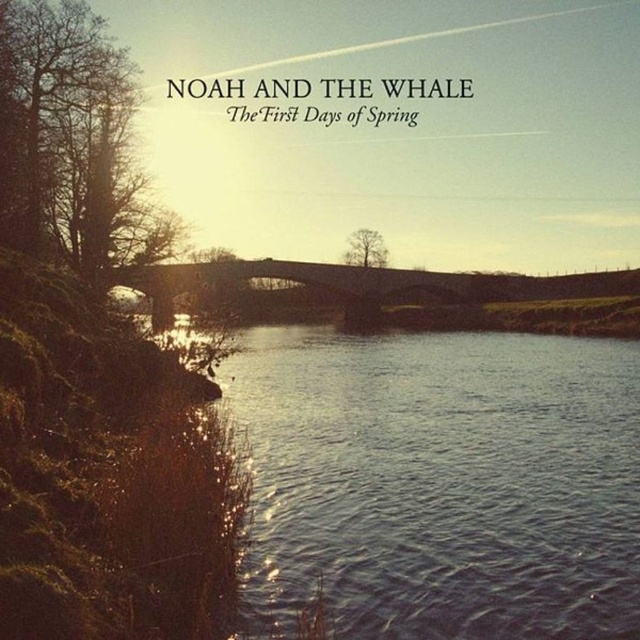
In the scene shown: You are standing on the left bank of the river and want to cross to the right bank. The bridge is the only path. However, you notice the blue water at center and the bare wood tree at left. Which object is closer to your current position on the left bank?

The bare wood tree at left is closer to your current position on the left bank because it is positioned to the left of the blue water at center, which is further towards the center of the river.

You are standing at the point marked by point (x=72, y=144), which is a bare wood tree at left. You want to walk to the bridge. In which direction should you head?

You should head towards the right because the bridge is on the opposite side of the river from the bare wood tree at left.